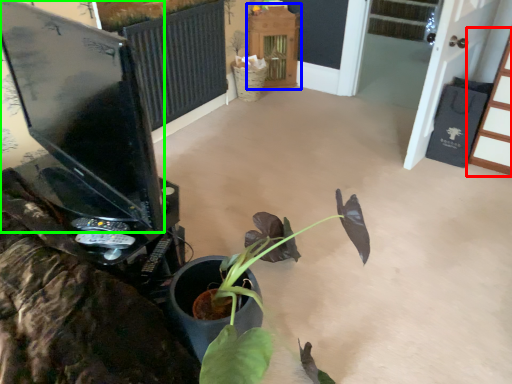
Question: Estimate the real-world distances between objects in this image. Which object is closer to furniture (highlighted by a red box), furniture (highlighted by a blue box) or computer monitor (highlighted by a green box)?

Choices:
 (A) furniture
 (B) computer monitor

Answer: (A)